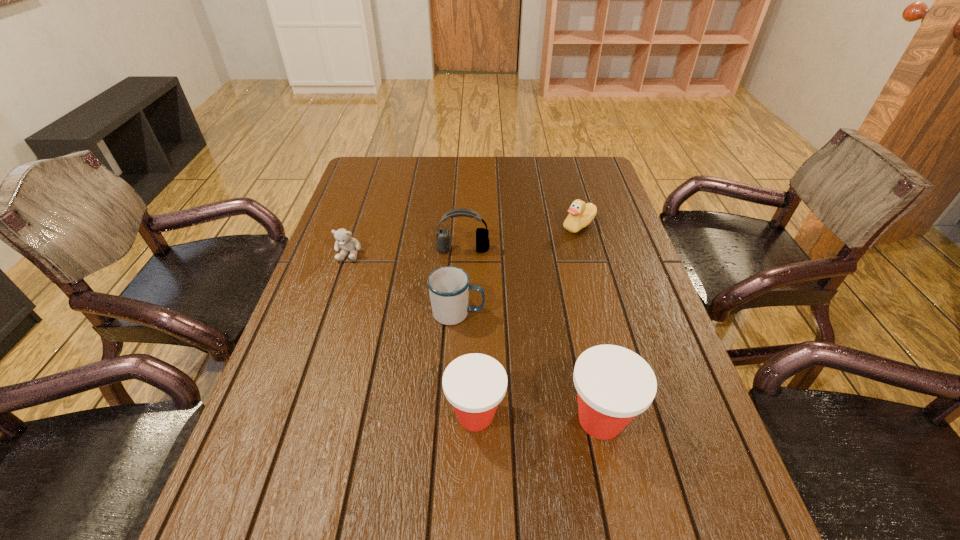
This screenshot has width=960, height=540. Find the location of `vacant space that satisfies the following two spatial constraints: 1. on the handle side of the third nearest object; 2. on the back side of the shorter Dixie cup`. vacant space that satisfies the following two spatial constraints: 1. on the handle side of the third nearest object; 2. on the back side of the shorter Dixie cup is located at coordinates (452, 415).

Where is `free space that satisfies the following two spatial constraints: 1. at the beak of the duck; 2. on the face of the teddy bear`? free space that satisfies the following two spatial constraints: 1. at the beak of the duck; 2. on the face of the teddy bear is located at coordinates (587, 253).

Where is `vacant area in the image that satisfies the following two spatial constraints: 1. on the handle side of the shorter Dixie cup; 2. on the right side of the mug`? The width and height of the screenshot is (960, 540). vacant area in the image that satisfies the following two spatial constraints: 1. on the handle side of the shorter Dixie cup; 2. on the right side of the mug is located at coordinates (452, 415).